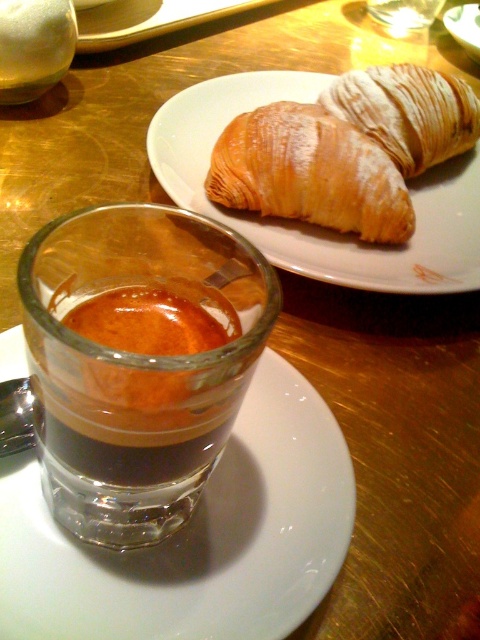
You are a server at the restaurant and need to place a napkin between the golden flaky croissant at upper center and the translucent glass cup at center. Can you fit the napkin there?

The golden flaky croissant at upper center and the translucent glass cup at center are 11.73 inches apart, so yes, you can fit a napkin between them since the distance is sufficient.

In the scene shown: You are a customer at a cafe and want to grab the golden flaky croissant at upper center and the translucent glass cup at center. Which item will your hand reach first when moving from your position?

The golden flaky croissant at upper center will be reached first because it is positioned in front of the translucent glass cup at center, making it closer to your hand.

You are a waiter carrying a tray of dishes. You need to place a new dessert plate between the golden brown croissant at upper right and the translucent glass cup at center. Can you fit it there?

The distance between the golden brown croissant at upper right and the translucent glass cup at center is 27.85 centimeters. Since the dessert plate is likely smaller than this space, it should fit comfortably between them.